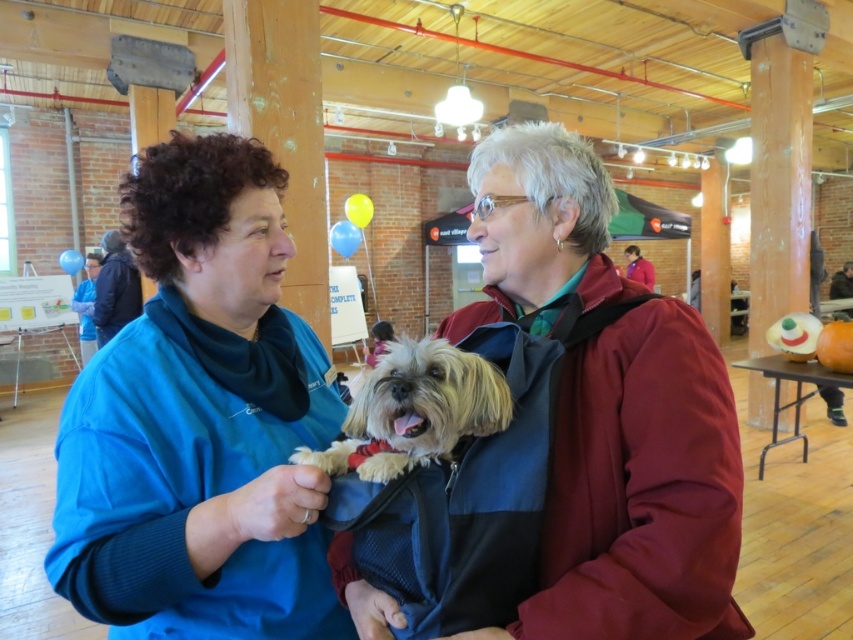
Question: Considering the real-world distances, which object is closest to the dark brown leather jacket at upper right?

Choices:
 (A) velvet maroon jacket at center
 (B) fluffy beige dog at center
 (C) red fabric jacket at upper right
 (D) blue fabric shirt at left

Answer: (C)

Question: Which point is farther from the camera taking this photo?

Choices:
 (A) (378, 611)
 (B) (645, 260)
 (C) (846, 280)
 (D) (102, 248)

Answer: (C)

Question: Is blue fleece jacket at upper left smaller than blue fabric shirt at left?

Choices:
 (A) yes
 (B) no

Answer: (A)

Question: Based on their relative distances, which object is farther from the velvet maroon jacket at center?

Choices:
 (A) blue fleece jacket at upper left
 (B) blue fleece jacket at center
 (C) dark brown leather jacket at upper right

Answer: (C)

Question: Can you confirm if blue fleece jacket at center is positioned to the right of red fabric jacket at upper right?

Choices:
 (A) no
 (B) yes

Answer: (A)

Question: Is blue fleece jacket at center above red fabric jacket at upper right?

Choices:
 (A) yes
 (B) no

Answer: (B)